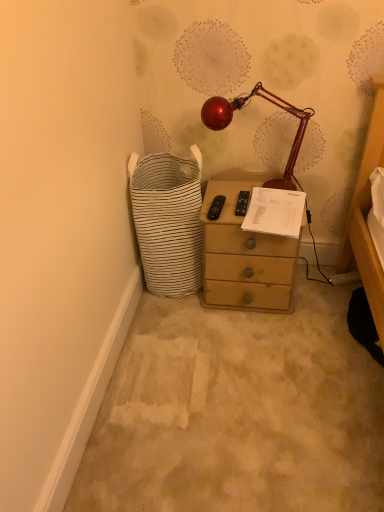
You are a GUI agent. You are given a task and a screenshot of the screen. Output one action in this format:
    pyautogui.click(x=<x>, y=<y>)
    Task: Click on the free location above matte brown chest of drawers at center (from a real-world perspective)
    
    Given the screenshot: What is the action you would take?
    pyautogui.click(x=248, y=207)